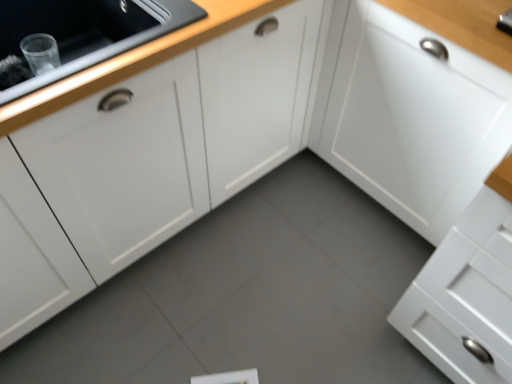
What do you see at coordinates (123, 165) in the screenshot? I see `white matte cabinet at left, the 2th cabinetry viewed from the right` at bounding box center [123, 165].

This screenshot has height=384, width=512. I want to click on white matte cabinet at left, which is the first cabinetry in left-to-right order, so click(x=123, y=165).

Image resolution: width=512 pixels, height=384 pixels. Describe the element at coordinates (408, 116) in the screenshot. I see `white matte cabinet at upper right, which ranks as the first cabinetry in right-to-left order` at that location.

Identify the location of white matte cabinet at upper right, the second cabinetry in the left-to-right sequence. The height and width of the screenshot is (384, 512). (408, 116).

This screenshot has height=384, width=512. I want to click on white matte cabinet at left, which is the first cabinetry in left-to-right order, so click(123, 165).

Is white matte cabinet at left, which is the first cabinetry in left-to-right order, to the right of white matte cabinet at upper right, the second cabinetry in the left-to-right sequence, from the viewer's perspective?

No, white matte cabinet at left, which is the first cabinetry in left-to-right order, is not to the right of white matte cabinet at upper right, the second cabinetry in the left-to-right sequence.

Considering their positions, is white matte cabinet at left, which is the first cabinetry in left-to-right order, located in front of or behind white matte cabinet at upper right, which ranks as the first cabinetry in right-to-left order?

In the image, white matte cabinet at left, which is the first cabinetry in left-to-right order, appears in front of white matte cabinet at upper right, which ranks as the first cabinetry in right-to-left order.

Which point is more forward, (60,175) or (439,183)?

The point (60,175) is in front.

From the image's perspective, is white matte cabinet at left, which is the first cabinetry in left-to-right order, below white matte cabinet at upper right, the second cabinetry in the left-to-right sequence?

No.

From a real-world perspective, between white matte cabinet at left, which is the first cabinetry in left-to-right order, and white matte cabinet at upper right, which ranks as the first cabinetry in right-to-left order, who is vertically higher?

In real-world perspective, white matte cabinet at left, which is the first cabinetry in left-to-right order, is above.

Considering the sizes of objects white matte cabinet at left, which is the first cabinetry in left-to-right order, and white matte cabinet at upper right, the second cabinetry in the left-to-right sequence, in the image provided, who is thinner, white matte cabinet at left, which is the first cabinetry in left-to-right order, or white matte cabinet at upper right, the second cabinetry in the left-to-right sequence,?

white matte cabinet at left, which is the first cabinetry in left-to-right order.

Based on the photo, is white matte cabinet at left, which is the first cabinetry in left-to-right order, taller than white matte cabinet at upper right, which ranks as the first cabinetry in right-to-left order?

No.

Considering the relative sizes of white matte cabinet at left, the 2th cabinetry viewed from the right, and white matte cabinet at upper right, which ranks as the first cabinetry in right-to-left order, in the image provided, is white matte cabinet at left, the 2th cabinetry viewed from the right, smaller than white matte cabinet at upper right, which ranks as the first cabinetry in right-to-left order,?

Indeed, white matte cabinet at left, the 2th cabinetry viewed from the right, has a smaller size compared to white matte cabinet at upper right, which ranks as the first cabinetry in right-to-left order.

Is white matte cabinet at left, which is the first cabinetry in left-to-right order, completely or partially outside of white matte cabinet at upper right, which ranks as the first cabinetry in right-to-left order?

That's correct, white matte cabinet at left, which is the first cabinetry in left-to-right order, is outside of white matte cabinet at upper right, which ranks as the first cabinetry in right-to-left order.

Is white matte cabinet at left, which is the first cabinetry in left-to-right order, far away from white matte cabinet at upper right, the second cabinetry in the left-to-right sequence?

No, white matte cabinet at left, which is the first cabinetry in left-to-right order, is not far away from white matte cabinet at upper right, the second cabinetry in the left-to-right sequence.

Is white matte cabinet at left, the 2th cabinetry viewed from the right, oriented towards white matte cabinet at upper right, which ranks as the first cabinetry in right-to-left order?

No, white matte cabinet at left, the 2th cabinetry viewed from the right, is not oriented towards white matte cabinet at upper right, which ranks as the first cabinetry in right-to-left order.

Could you measure the distance between white matte cabinet at left, which is the first cabinetry in left-to-right order, and white matte cabinet at upper right, which ranks as the first cabinetry in right-to-left order?

white matte cabinet at left, which is the first cabinetry in left-to-right order, is 70.59 centimeters from white matte cabinet at upper right, which ranks as the first cabinetry in right-to-left order.

Identify the location of cabinetry above the white matte cabinet at upper right, the second cabinetry in the left-to-right sequence (from a real-world perspective). click(x=123, y=165).

Considering the positions of objects white matte cabinet at upper right, the second cabinetry in the left-to-right sequence, and white matte cabinet at left, which is the first cabinetry in left-to-right order, in the image provided, who is more to the right, white matte cabinet at upper right, the second cabinetry in the left-to-right sequence, or white matte cabinet at left, which is the first cabinetry in left-to-right order,?

white matte cabinet at upper right, the second cabinetry in the left-to-right sequence, is more to the right.

Which is in front, white matte cabinet at upper right, the second cabinetry in the left-to-right sequence, or white matte cabinet at left, the 2th cabinetry viewed from the right?

white matte cabinet at left, the 2th cabinetry viewed from the right, is more forward.

Considering the positions of points (451, 179) and (117, 268), is point (451, 179) closer to camera compared to point (117, 268)?

Yes, point (451, 179) is closer to viewer.

From the image's perspective, is white matte cabinet at upper right, the second cabinetry in the left-to-right sequence, positioned above or below white matte cabinet at left, which is the first cabinetry in left-to-right order?

white matte cabinet at upper right, the second cabinetry in the left-to-right sequence, is below white matte cabinet at left, which is the first cabinetry in left-to-right order.

From a real-world perspective, is white matte cabinet at upper right, which ranks as the first cabinetry in right-to-left order, on white matte cabinet at left, which is the first cabinetry in left-to-right order?

Actually, white matte cabinet at upper right, which ranks as the first cabinetry in right-to-left order, is physically below white matte cabinet at left, which is the first cabinetry in left-to-right order, in the real world.

In terms of width, does white matte cabinet at upper right, the second cabinetry in the left-to-right sequence, look wider or thinner when compared to white matte cabinet at left, which is the first cabinetry in left-to-right order?

Considering their sizes, white matte cabinet at upper right, the second cabinetry in the left-to-right sequence, looks broader than white matte cabinet at left, which is the first cabinetry in left-to-right order.

Does white matte cabinet at upper right, the second cabinetry in the left-to-right sequence, have a lesser height compared to white matte cabinet at left, which is the first cabinetry in left-to-right order?

No, white matte cabinet at upper right, the second cabinetry in the left-to-right sequence, is not shorter than white matte cabinet at left, which is the first cabinetry in left-to-right order.

In the scene shown: Does white matte cabinet at upper right, which ranks as the first cabinetry in right-to-left order, have a larger size compared to white matte cabinet at left, which is the first cabinetry in left-to-right order?

Indeed, white matte cabinet at upper right, which ranks as the first cabinetry in right-to-left order, has a larger size compared to white matte cabinet at left, which is the first cabinetry in left-to-right order.

Is white matte cabinet at upper right, the second cabinetry in the left-to-right sequence, spatially inside white matte cabinet at left, which is the first cabinetry in left-to-right order, or outside of it?

white matte cabinet at upper right, the second cabinetry in the left-to-right sequence, lies outside white matte cabinet at left, which is the first cabinetry in left-to-right order.

Are white matte cabinet at upper right, the second cabinetry in the left-to-right sequence, and white matte cabinet at left, which is the first cabinetry in left-to-right order, far apart?

That's not correct — white matte cabinet at upper right, the second cabinetry in the left-to-right sequence, is a little close to white matte cabinet at left, which is the first cabinetry in left-to-right order.

Consider the image. Is white matte cabinet at upper right, which ranks as the first cabinetry in right-to-left order, facing away from white matte cabinet at left, the 2th cabinetry viewed from the right?

No, white matte cabinet at upper right, which ranks as the first cabinetry in right-to-left order, is not facing the opposite direction of white matte cabinet at left, the 2th cabinetry viewed from the right.

How different are the orientations of white matte cabinet at upper right, the second cabinetry in the left-to-right sequence, and white matte cabinet at left, which is the first cabinetry in left-to-right order, in degrees?

The facing directions of white matte cabinet at upper right, the second cabinetry in the left-to-right sequence, and white matte cabinet at left, which is the first cabinetry in left-to-right order, are 90 degrees apart.

Measure the distance from white matte cabinet at upper right, which ranks as the first cabinetry in right-to-left order, to white matte cabinet at left, which is the first cabinetry in left-to-right order.

The distance of white matte cabinet at upper right, which ranks as the first cabinetry in right-to-left order, from white matte cabinet at left, which is the first cabinetry in left-to-right order, is 70.59 centimeters.

You are a GUI agent. You are given a task and a screenshot of the screen. Output one action in this format:
    pyautogui.click(x=<x>, y=<y>)
    Task: Click on the cabinetry below the white matte cabinet at left, the 2th cabinetry viewed from the right (from the image's perspective)
    The width and height of the screenshot is (512, 384).
    Given the screenshot: What is the action you would take?
    pyautogui.click(x=408, y=116)

Locate an element on the screen. Image resolution: width=512 pixels, height=384 pixels. cabinetry on the left side of white matte cabinet at upper right, which ranks as the first cabinetry in right-to-left order is located at coordinates (123, 165).

I want to click on cabinetry in front of the white matte cabinet at upper right, the second cabinetry in the left-to-right sequence, so click(123, 165).